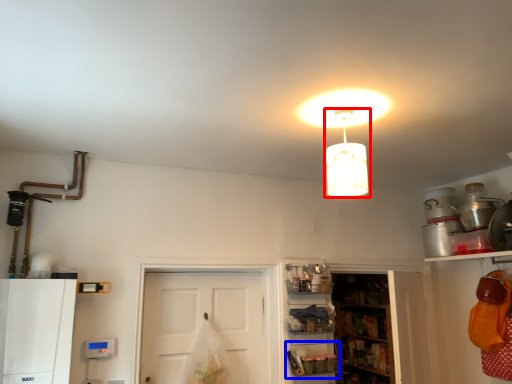
Question: Which object is further to the camera taking this photo, lamp (highlighted by a red box) or shelf (highlighted by a blue box)?

Choices:
 (A) lamp
 (B) shelf

Answer: (B)